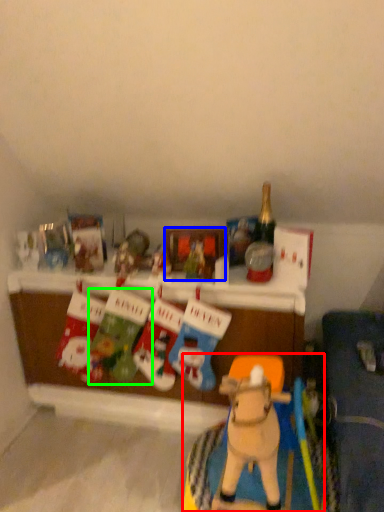
Question: Based on their relative distances, which object is nearer to toy (highlighted by a red box)? Choose from picture frame (highlighted by a blue box) and toy (highlighted by a green box).

Choices:
 (A) picture frame
 (B) toy

Answer: (B)